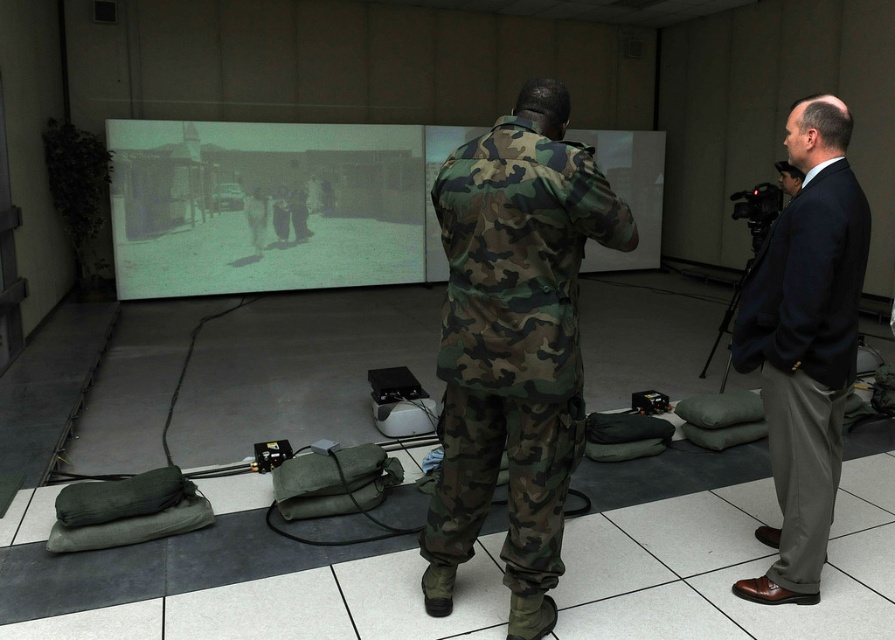
Question: Among these points, which one is farthest from the camera?

Choices:
 (A) (722, 380)
 (B) (794, 500)
 (C) (149, 163)

Answer: (C)

Question: From the image, what is the correct spatial relationship of dark blue suit at right in relation to black matte tripod at right?

Choices:
 (A) below
 (B) above

Answer: (A)

Question: Is camo fabric uniform at center positioned at the back of black matte tripod at right?

Choices:
 (A) yes
 (B) no

Answer: (B)

Question: Which object appears farthest from the camera in this image?

Choices:
 (A) black matte tripod at right
 (B) dark suit at right
 (C) camo fabric uniform at center

Answer: (A)

Question: Is dark blue suit at right below black matte tripod at right?

Choices:
 (A) no
 (B) yes

Answer: (B)

Question: Which object is closer to the camera taking this photo?

Choices:
 (A) camo fabric uniform at center
 (B) black matte tripod at right

Answer: (A)